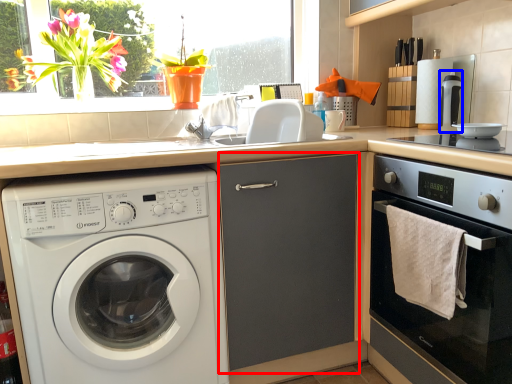
Question: Which object appears closest to the camera in this image, screen door (highlighted by a red box) or coffee machine (highlighted by a blue box)?

Choices:
 (A) screen door
 (B) coffee machine

Answer: (A)